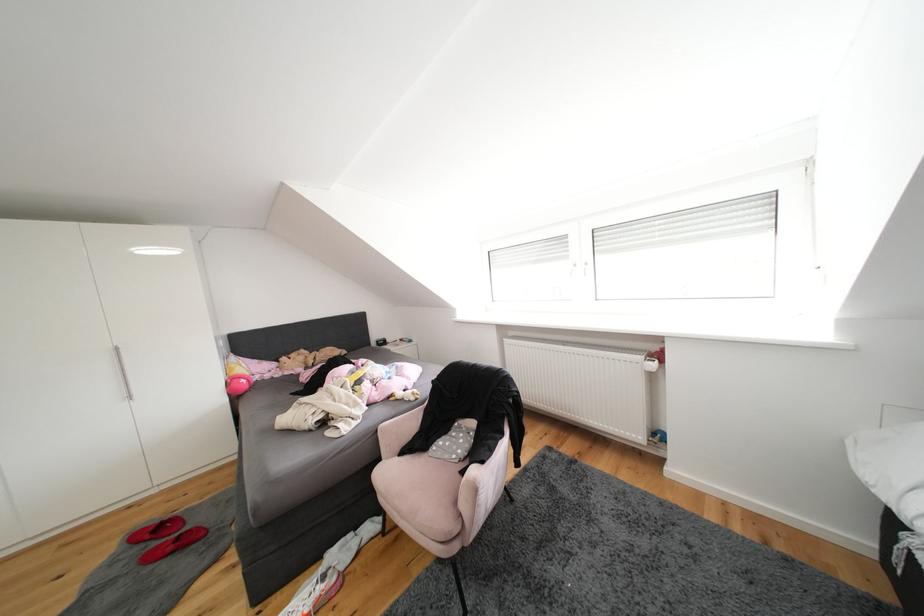
I want to click on radiator thermostat knob, so click(x=650, y=365).